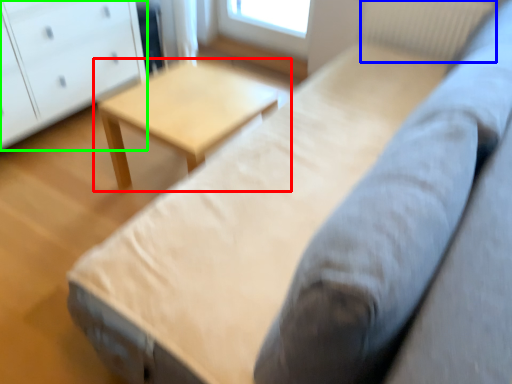
Question: Which object is the closest to the table (highlighted by a red box)? Choose among these: radiator (highlighted by a blue box) or chest of drawers (highlighted by a green box).

Choices:
 (A) radiator
 (B) chest of drawers

Answer: (B)